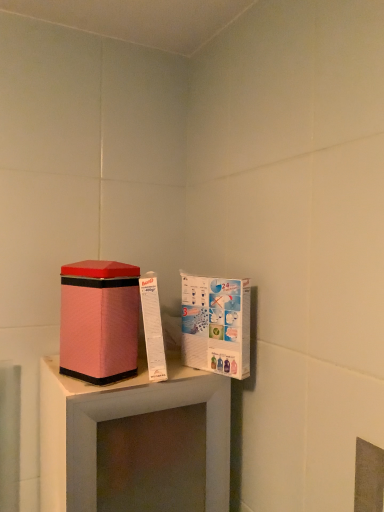
Question: Based on their positions, is white cardboard box at upper right located to the left or right of pink fabric/textured box at left?

Choices:
 (A) left
 (B) right

Answer: (B)

Question: From a real-world perspective, relative to pink fabric/textured box at left, is white cardboard box at upper right vertically above or below?

Choices:
 (A) above
 (B) below

Answer: (B)

Question: Would you say white cardboard box at upper right is inside or outside pink fabric/textured box at left?

Choices:
 (A) inside
 (B) outside

Answer: (B)

Question: Based on their positions, is pink fabric/textured box at left located to the left or right of white cardboard box at upper right?

Choices:
 (A) left
 (B) right

Answer: (A)

Question: Is pink fabric/textured box at left wider or thinner than white cardboard box at upper right?

Choices:
 (A) wide
 (B) thin

Answer: (A)

Question: Choose the correct answer: Is pink fabric/textured box at left inside white cardboard box at upper right or outside it?

Choices:
 (A) outside
 (B) inside

Answer: (A)

Question: From a real-world perspective, relative to white cardboard box at upper right, is pink fabric/textured box at left vertically above or below?

Choices:
 (A) below
 (B) above

Answer: (B)